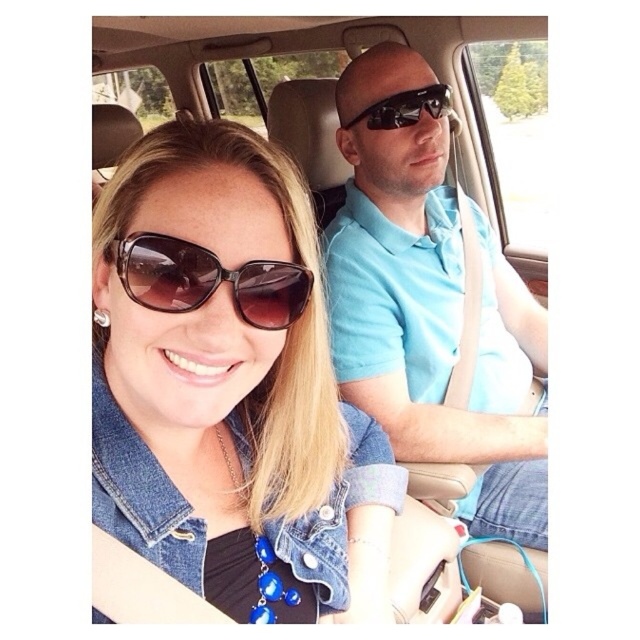
Which is in front, point (177, 557) or point (115, 252)?

Point (115, 252) is more forward.

Is denim jacket at center bigger than brown matte sunglasses at center?

Yes, denim jacket at center is bigger than brown matte sunglasses at center.

Locate an element on the screen. This screenshot has height=640, width=640. denim jacket at center is located at coordinates (224, 376).

Does denim jacket at center have a lesser width compared to black reflective sunglasses at upper center?

No, denim jacket at center is not thinner than black reflective sunglasses at upper center.

Who is more forward, (282,417) or (356,115)?

Point (282,417)

I want to click on denim jacket at center, so click(224, 376).

Which is behind, point (444, 298) or point (384, 129)?

Point (444, 298)

Based on the photo, who is shorter, light blue polo shirt at center or black reflective sunglasses at upper center?

black reflective sunglasses at upper center is shorter.

Between point (472, 445) and point (436, 116), which one is positioned in front?

Point (472, 445) is more forward.

Find the location of a particular element. light blue polo shirt at center is located at coordinates (432, 308).